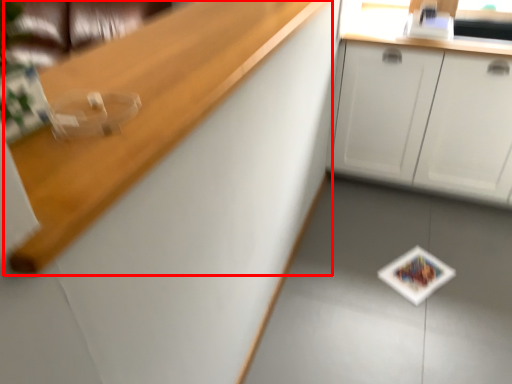
Question: Considering the relative positions of counter top (annotated by the red box) and cabinetry in the image provided, where is counter top (annotated by the red box) located with respect to the staircase?

Choices:
 (A) right
 (B) left

Answer: (B)